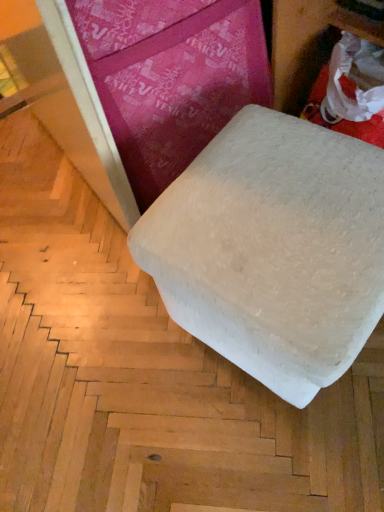
Where is `white fabric ottoman at center`? white fabric ottoman at center is located at coordinates (273, 249).

What is the approximate width of white fabric ottoman at center?

white fabric ottoman at center is 16.53 inches in width.

What do you see at coordinates (273, 249) in the screenshot? The width and height of the screenshot is (384, 512). I see `white fabric ottoman at center` at bounding box center [273, 249].

This screenshot has width=384, height=512. I want to click on white fabric ottoman at center, so click(x=273, y=249).